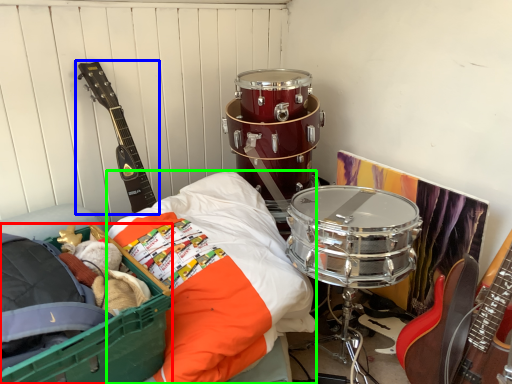
Question: Which object is positioned farthest from storage box (highlighted by a red box)? Select from guitar (highlighted by a blue box) and sheet (highlighted by a green box).

Choices:
 (A) guitar
 (B) sheet

Answer: (A)